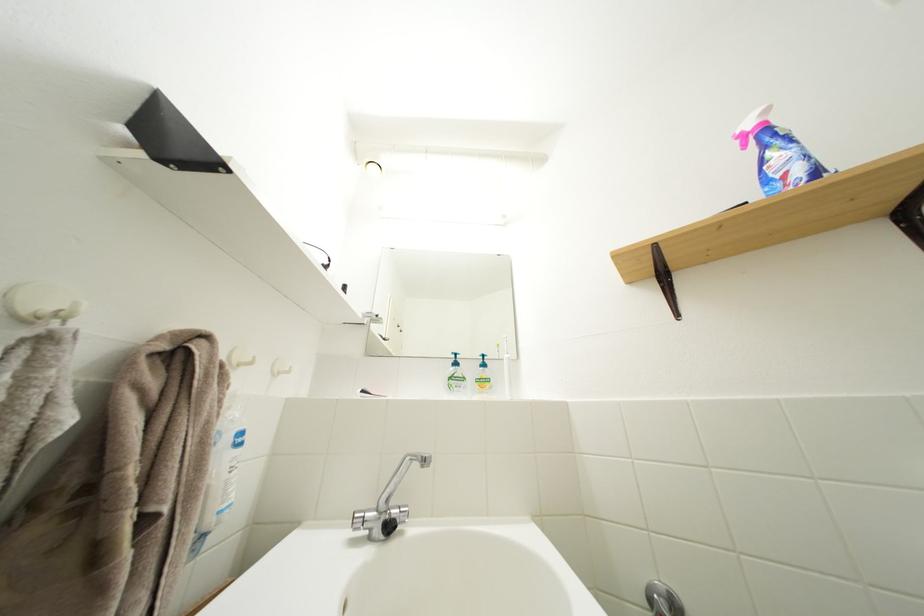
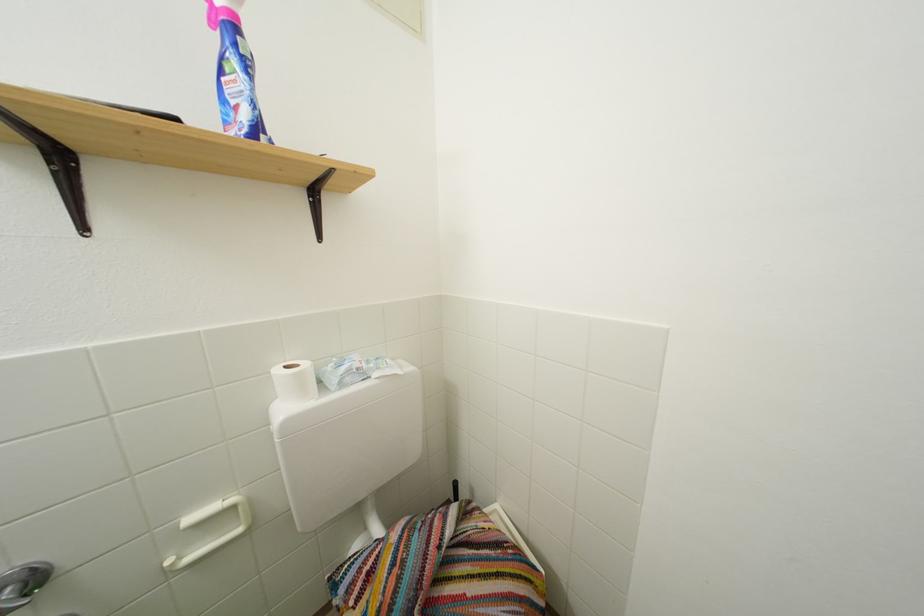
Question: The images are taken continuously from a first-person perspective. In which direction is your viewpoint rotating?

Choices:
 (A) Left
 (B) Right
 (C) Up
 (D) Down

Answer: (B)